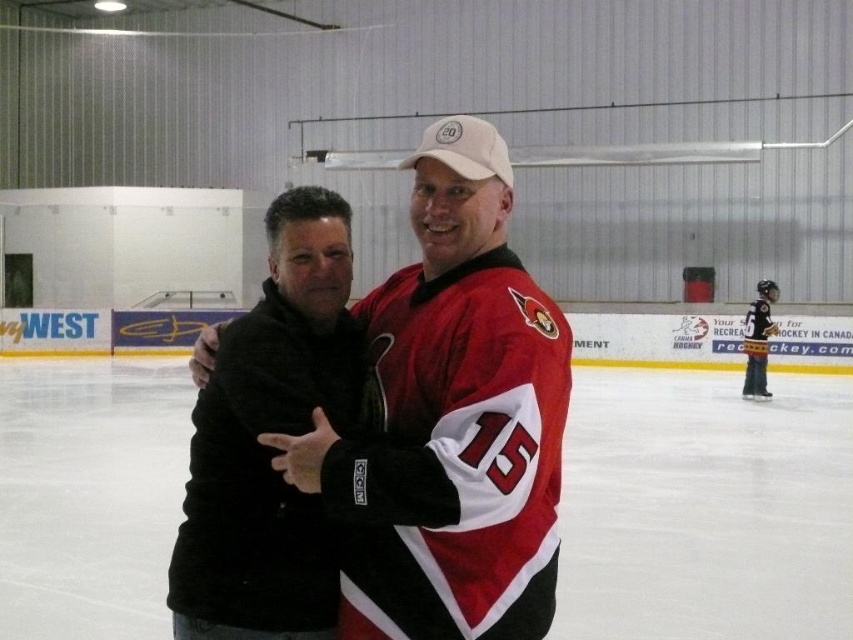
Can you confirm if matte black jacket at center is shorter than black fuzzy jacket at center?

No.

In the scene shown: Which is above, matte black jacket at center or black fuzzy jacket at center?

matte black jacket at center

Does point (503, 586) come farther from viewer compared to point (231, 588)?

That is False.

Identify the location of matte black jacket at center. The image size is (853, 640). (450, 419).

Who is shorter, matte black jacket at center or black jersey at right?

Standing shorter between the two is matte black jacket at center.

Can you confirm if matte black jacket at center is thinner than black jersey at right?

Incorrect, matte black jacket at center's width is not less than black jersey at right's.

Is point (483, 224) positioned in front of point (749, 356)?

Yes.

This screenshot has height=640, width=853. I want to click on matte black jacket at center, so click(x=450, y=419).

Who is more distant from viewer, (231, 593) or (751, 378)?

The point (751, 378) is behind.

Is black fuzzy jacket at center bigger than black jersey at right?

Incorrect, black fuzzy jacket at center is not larger than black jersey at right.

Is point (315, 509) closer to camera compared to point (759, 355)?

Yes, it is.

Find the location of `black fuzzy jacket at center`. black fuzzy jacket at center is located at coordinates (264, 445).